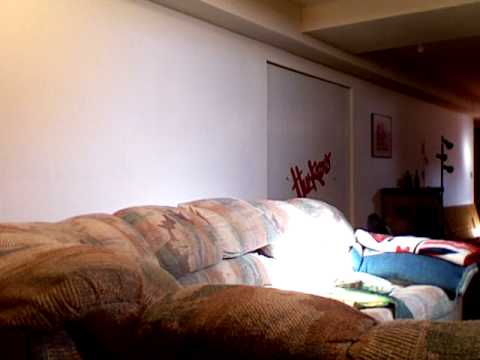
This screenshot has height=360, width=480. What are the coordinates of `lights` in the screenshot? It's located at (448, 171), (437, 157), (450, 145).